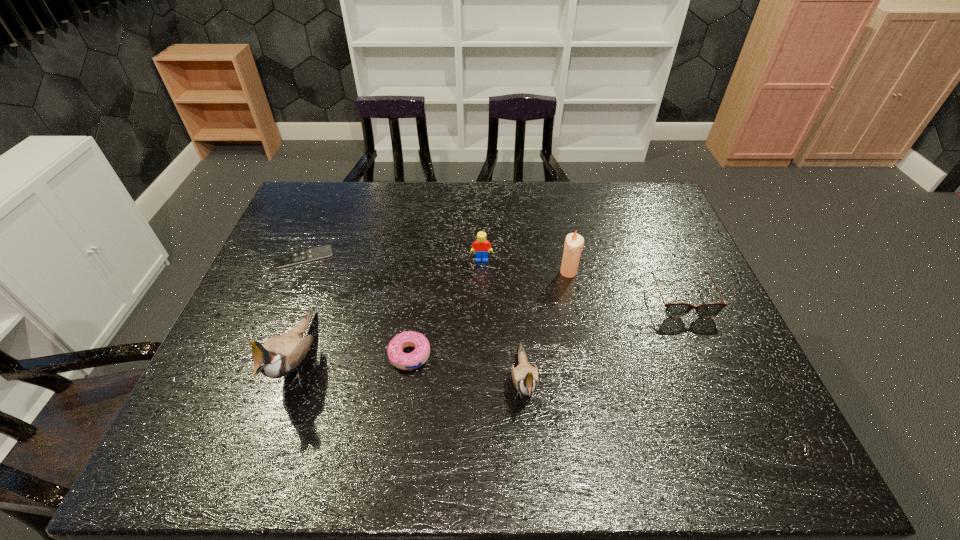
Where is `unoccupied position between the fourth tallest object and the candle`? This screenshot has height=540, width=960. unoccupied position between the fourth tallest object and the candle is located at coordinates (525, 266).

Find the location of `free spot between the fifth tallest object and the sixth object from left to right`. free spot between the fifth tallest object and the sixth object from left to right is located at coordinates (625, 286).

Find the location of `free area in between the fifth object from left to right and the shortest object`. free area in between the fifth object from left to right and the shortest object is located at coordinates (414, 319).

The image size is (960, 540). I want to click on free space between the fourth shortest object and the left bird, so click(390, 309).

Identify the location of vacant space that's between the remote control and the sixth tallest object. The width and height of the screenshot is (960, 540). (357, 306).

Locate an element on the screen. The width and height of the screenshot is (960, 540). object that is the fourth closest to the candle is located at coordinates (405, 361).

Identify the location of the third closest object to the spectacles. (480, 246).

The width and height of the screenshot is (960, 540). Identify the location of vacant region that satisfies the following two spatial constraints: 1. on the front side of the shortest object; 2. on the right side of the candle. (298, 272).